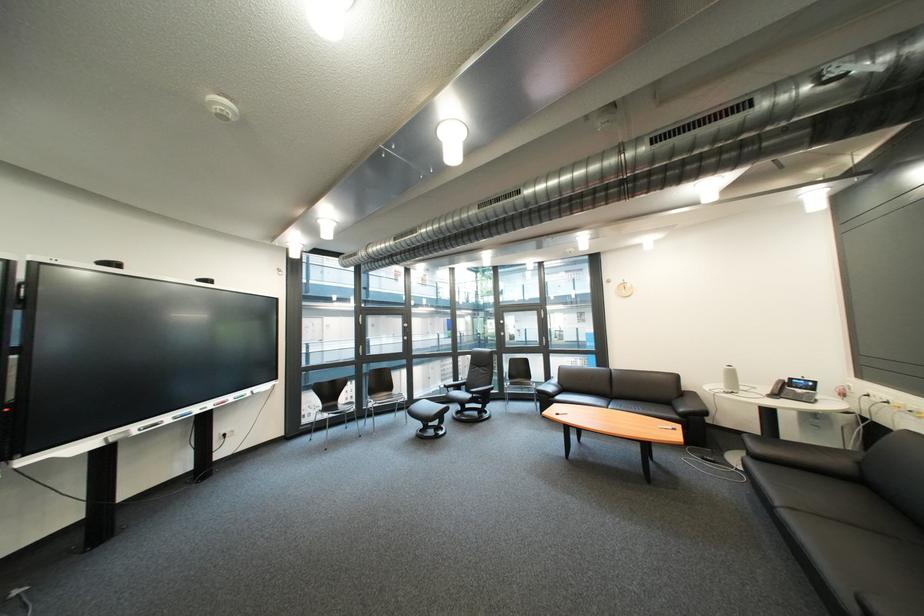
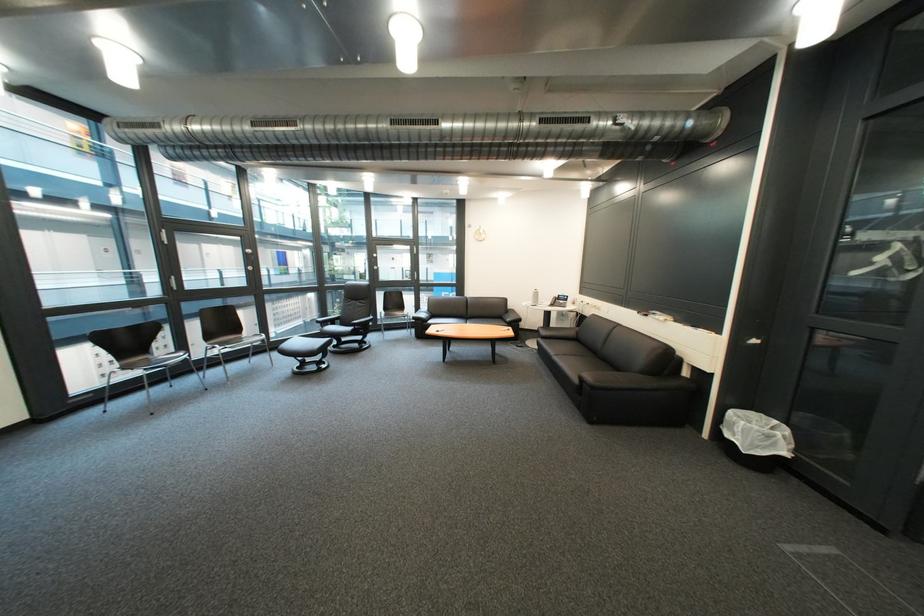
Where in the second image is the point corresponding to (385,402) from the first image?

(229, 347)